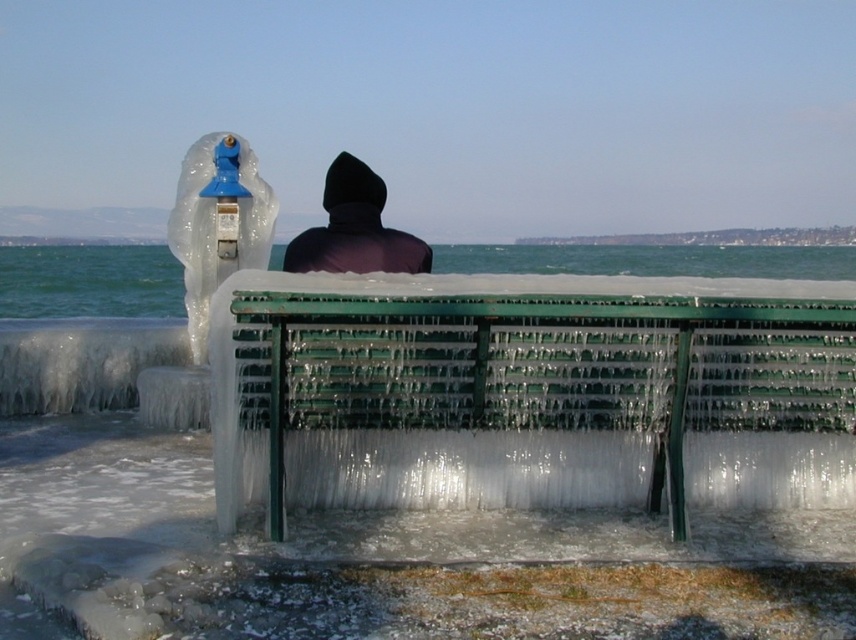
You are standing in the winter scene and want to see the clear ice water at center without the dark matte hood at center blocking your view. Is it possible to do so?

The clear ice water at center is in front of the dark matte hood at center, so you can see the clear ice water at center without obstruction from the dark matte hood at center.

You are a photographer trying to capture a wide shot of the clear ice water at center and the dark matte hood at center. Your camera has a maximum focus range of 70 meters. Will you be able to capture both subjects in focus at the same time?

The clear ice water at center and dark matte hood at center are 71.34 meters apart. Since your camera can only focus up to 70 meters, you won not be able to capture both in focus simultaneously.